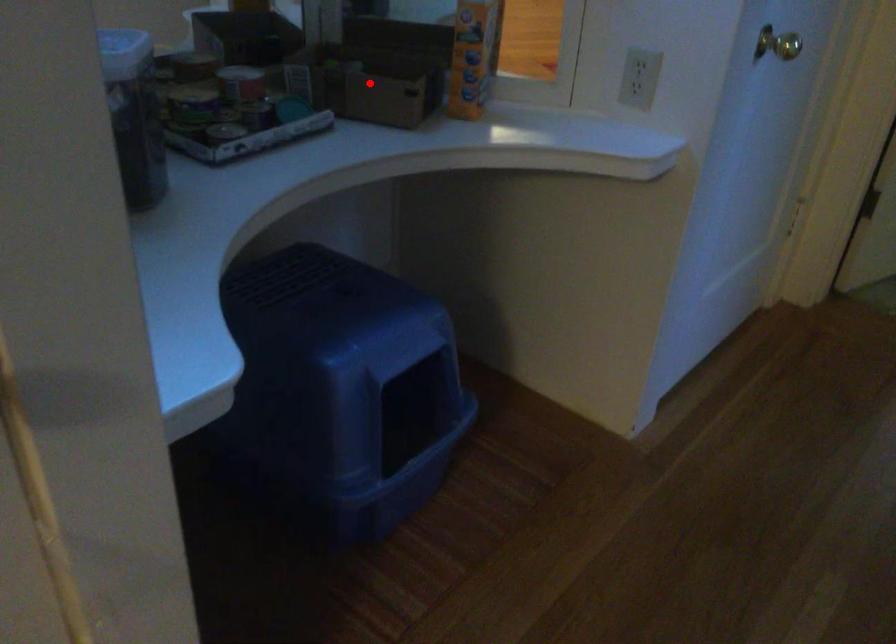
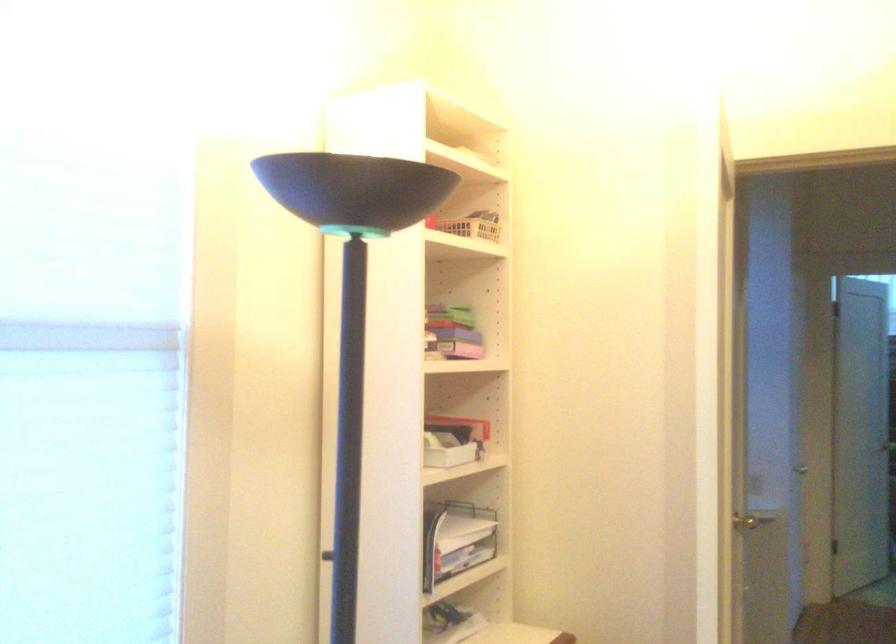
Question: I am providing you with two images of the same scene from different viewpoints. A red point is marked on the first image. At the location where the point appears in image 1, is it still visible in image 2?

Choices:
 (A) Yes
 (B) No

Answer: (B)